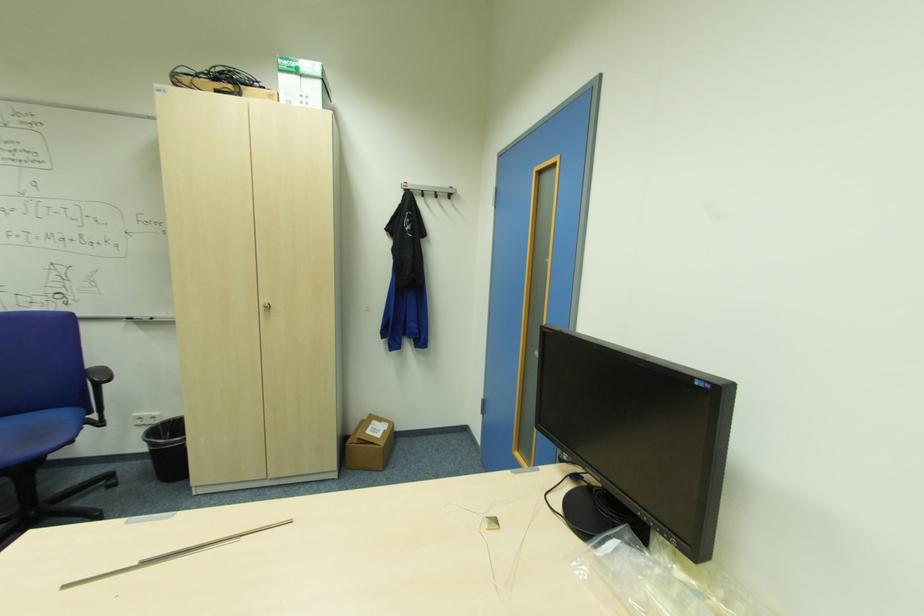
At what (x,y) coordinates should I click in order to perform the action: click on black chair armrest. Please return your answer as a coordinate pair (x, y). The width and height of the screenshot is (924, 616). Looking at the image, I should click on (99, 374).